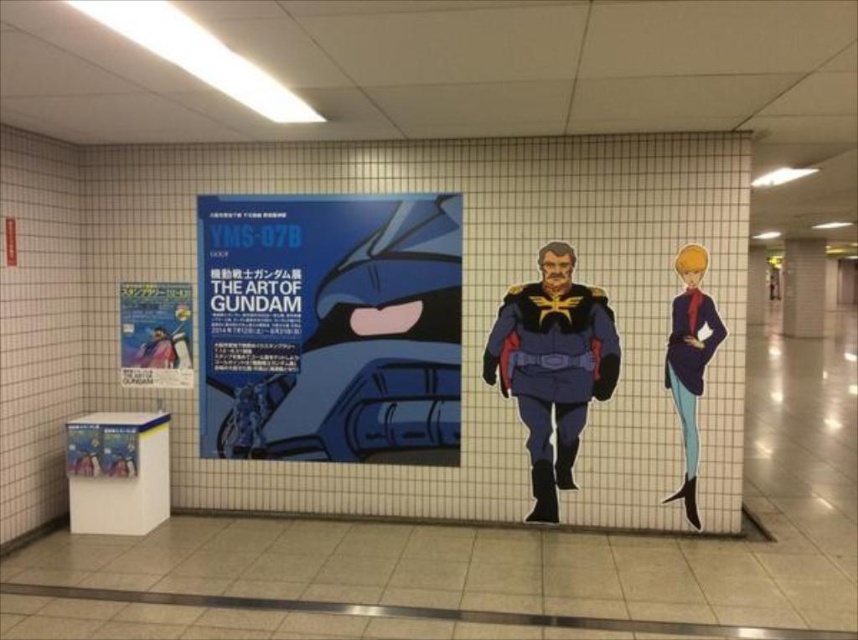
You are standing in a subway station hallway. You see a point marked at coordinates (329, 324). What object is located at that point?

The blue matte poster at center is located at point (329, 324).

You are a visitor in the station and want to take a photo of the smooth blue suit at right without the blue matte poster at center appearing in the background. Is this possible?

The blue matte poster at center is positioned over the smooth blue suit at right, so it would be visible in the background when taking a photo of the smooth blue suit at right. To avoid the poster, you would need to adjust your angle or move to a different position where the poster is not behind the suit.

You are standing in the hallway and see a point marked at coordinates (553, 365). What object is located at that point?

The point at coordinates (553, 365) marks the blue fabric uniform at center.